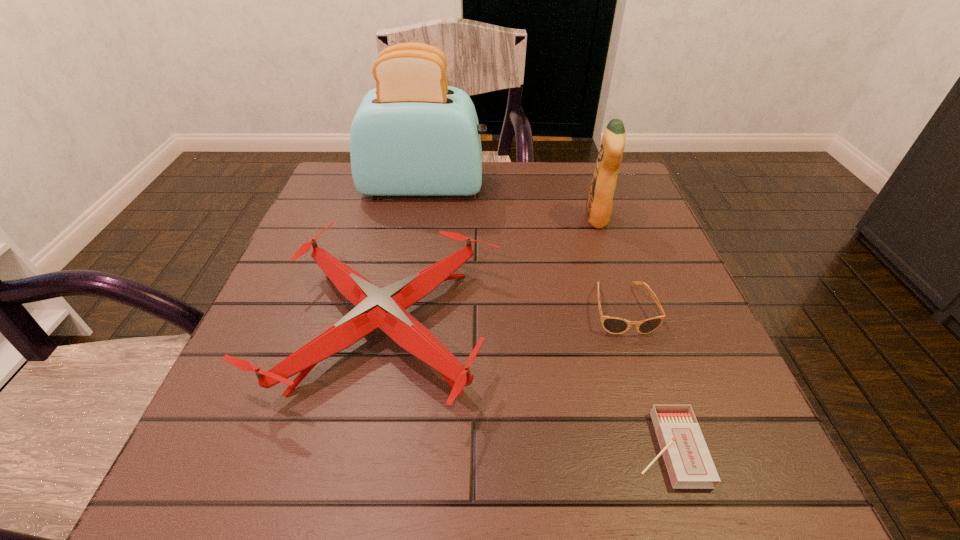
You are a GUI agent. You are given a task and a screenshot of the screen. Output one action in this format:
    pyautogui.click(x=<x>, y=<y>)
    Task: Click on the drone that is positioned at the left edge
    
    Given the screenshot: What is the action you would take?
    pyautogui.click(x=385, y=308)

Locate an element on the screen. This screenshot has width=960, height=540. detergent that is at the right edge is located at coordinates (599, 202).

At what (x,y) coordinates should I click in order to perform the action: click on sunglasses at the right edge. Please return your answer as a coordinate pair (x, y). This screenshot has width=960, height=540. Looking at the image, I should click on (614, 325).

Find the location of `matchbox that is at the right edge`. matchbox that is at the right edge is located at coordinates (688, 461).

At what (x,y) coordinates should I click in order to perform the action: click on object located at the far left corner. Please return your answer as a coordinate pair (x, y). The image size is (960, 540). Looking at the image, I should click on (413, 135).

Identify the location of object that is at the far right corner. (599, 202).

Identify the location of object that is at the near right corner. The image size is (960, 540). (688, 461).

At what (x,y) coordinates should I click in order to perform the action: click on vacant area at the far edge of the desktop. Please return your answer as a coordinate pair (x, y). This screenshot has width=960, height=540. Looking at the image, I should click on (523, 179).

In the image, there is a desktop. Identify the location of vacant space at the left edge. This screenshot has width=960, height=540. (324, 299).

In the image, there is a desktop. Where is `free region at the right edge`? The height and width of the screenshot is (540, 960). free region at the right edge is located at coordinates (652, 367).